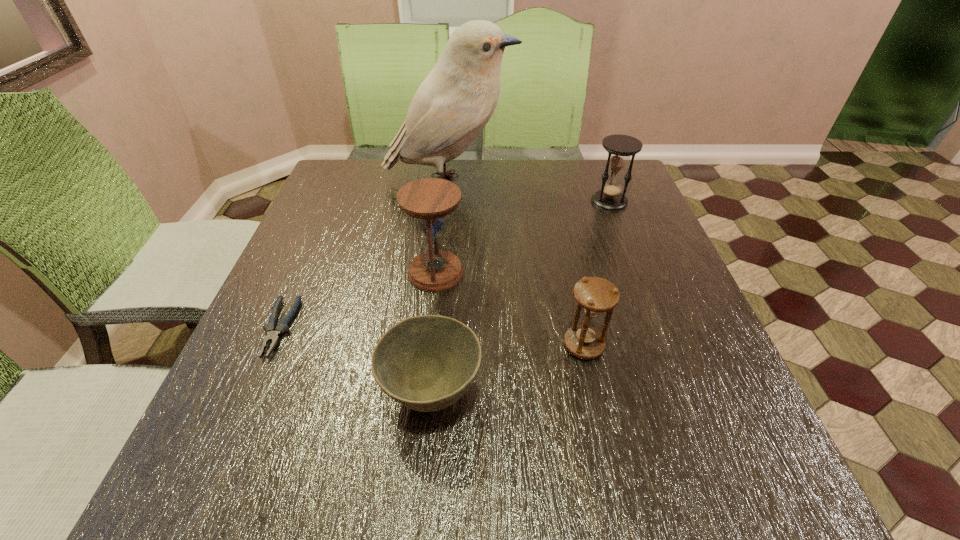
Where is `object that is at the far right corner`? object that is at the far right corner is located at coordinates (620, 147).

I want to click on blank space at the far edge, so click(481, 161).

Locate an element on the screen. The image size is (960, 540). vacant space at the near edge of the desktop is located at coordinates (655, 461).

The image size is (960, 540). I want to click on free space at the right edge of the desktop, so click(695, 313).

Locate an element on the screen. The width and height of the screenshot is (960, 540). vacant area at the near left corner of the desktop is located at coordinates (276, 475).

Image resolution: width=960 pixels, height=540 pixels. In the image, there is a desktop. In order to click on blank space at the far right corner in this screenshot , I will do `click(592, 204)`.

Where is `free point between the third farthest object and the second hourglass from left to right`? The height and width of the screenshot is (540, 960). free point between the third farthest object and the second hourglass from left to right is located at coordinates (510, 309).

This screenshot has height=540, width=960. In order to click on free spot between the rightmost object and the tallest hourglass in this screenshot , I will do `click(522, 237)`.

Image resolution: width=960 pixels, height=540 pixels. Identify the location of free space between the second object from right to left and the second tallest object. (510, 309).

Locate an element on the screen. The width and height of the screenshot is (960, 540). vacant space that's between the tallest object and the fifth object from left to right is located at coordinates (516, 264).